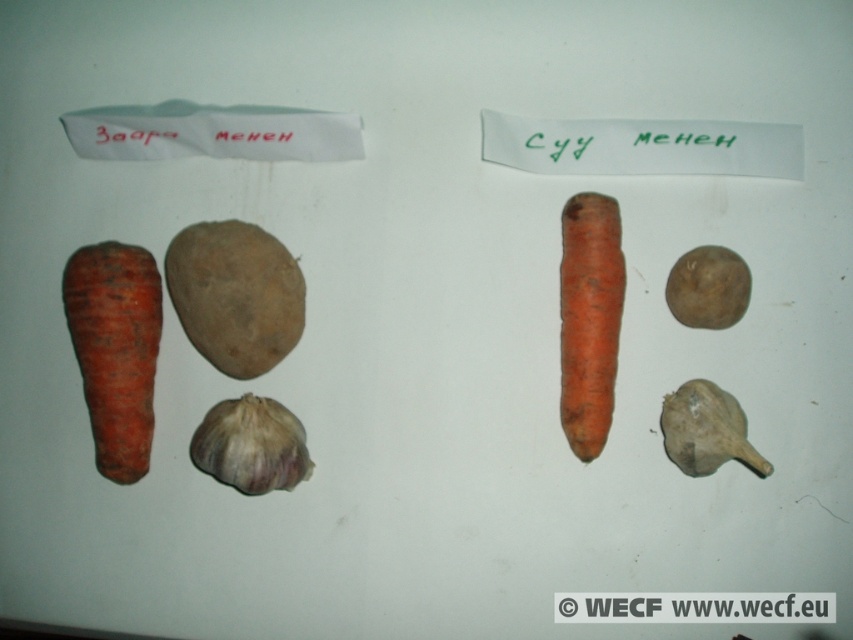
Locate an element on the screen. brown rough potato at center is located at coordinates [x=235, y=294].

Can you confirm if brown rough potato at center is smaller than grayish matte garlic at lower right?

No, brown rough potato at center is not smaller than grayish matte garlic at lower right.

Where is `brown rough potato at center`? brown rough potato at center is located at coordinates (235, 294).

Is point (201, 444) closer to camera compared to point (685, 448)?

No, (201, 444) is behind (685, 448).

Based on the photo, does purple papery garlic at lower center lie behind grayish matte garlic at lower right?

Yes, it is.

Find the location of a particular element. purple papery garlic at lower center is located at coordinates (x=251, y=445).

Can you confirm if orange rough carrot at center is taller than grayish matte garlic at lower right?

Indeed, orange rough carrot at center has a greater height compared to grayish matte garlic at lower right.

Is orange rough carrot at center shorter than grayish matte garlic at lower right?

In fact, orange rough carrot at center may be taller than grayish matte garlic at lower right.

Is point (581, 326) in front of point (735, 442)?

No, it is behind (735, 442).

Where is `orange rough carrot at center`? This screenshot has height=640, width=853. orange rough carrot at center is located at coordinates (589, 317).